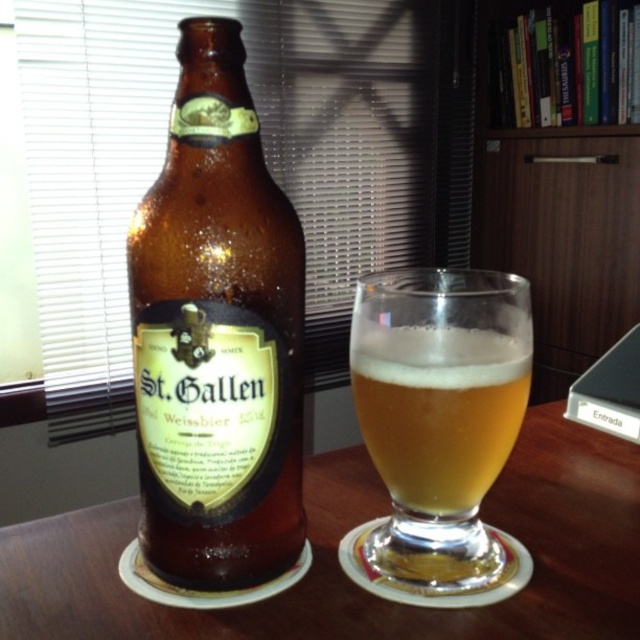
Looking at this image, does brown glass bottle at left appear on the right side of translucent glass beer at center?

No, brown glass bottle at left is not to the right of translucent glass beer at center.

Who is more forward, (173, 481) or (440, 538)?

Point (173, 481) is in front.

The height and width of the screenshot is (640, 640). What do you see at coordinates (216, 336) in the screenshot?
I see `brown glass bottle at left` at bounding box center [216, 336].

You are a GUI agent. You are given a task and a screenshot of the screen. Output one action in this format:
    pyautogui.click(x=<x>, y=<y>)
    Task: Click on the brown glass bottle at left
    
    Given the screenshot: What is the action you would take?
    pyautogui.click(x=216, y=336)

Does brown glass bottle at left have a lesser height compared to brown wooden table at center?

No, brown glass bottle at left is not shorter than brown wooden table at center.

Is brown glass bottle at left taller than brown wooden table at center?

Yes.

Is point (198, 406) positioned behind point (522, 461)?

No, (198, 406) is in front of (522, 461).

The width and height of the screenshot is (640, 640). Find the location of `brown glass bottle at left`. brown glass bottle at left is located at coordinates (216, 336).

Is brown wooden table at center shorter than translucent glass beer at center?

Indeed, brown wooden table at center has a lesser height compared to translucent glass beer at center.

Does brown wooden table at center appear on the right side of translucent glass beer at center?

No, brown wooden table at center is not to the right of translucent glass beer at center.

Identify the location of brown wooden table at center. This screenshot has width=640, height=640. (340, 568).